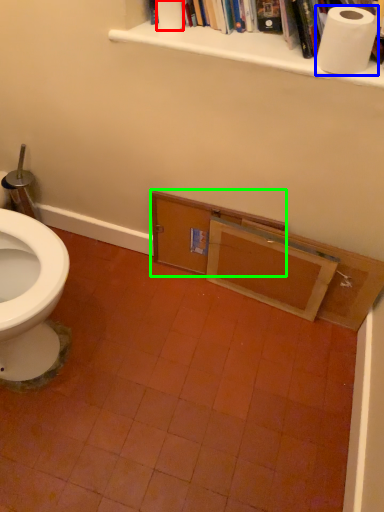
Question: Estimate the real-world distances between objects in this image. Which object is farther from toilet paper (highlighted by a red box), toilet paper (highlighted by a blue box) or drawer (highlighted by a green box)?

Choices:
 (A) toilet paper
 (B) drawer

Answer: (B)